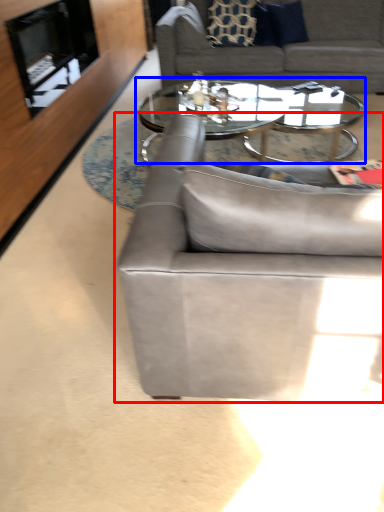
Question: Which object is closer to the camera taking this photo, studio couch (highlighted by a red box) or coffee table (highlighted by a blue box)?

Choices:
 (A) studio couch
 (B) coffee table

Answer: (A)